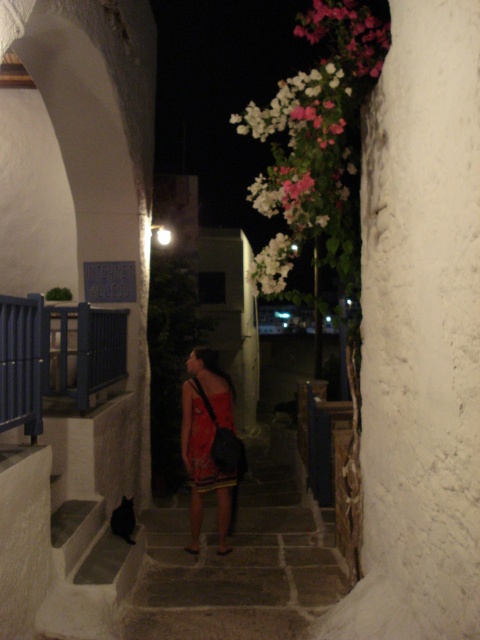
Is white rough textured pillar at center right positioned before red satin dress at center?

Yes, it is in front of red satin dress at center.

Can you confirm if white rough textured pillar at center right is positioned to the right of red satin dress at center?

Yes, white rough textured pillar at center right is to the right of red satin dress at center.

I want to click on white rough textured pillar at center right, so click(x=421, y=324).

Who is lower down, dark gray stone stairs at center or blue painted wood balustrade at left?

dark gray stone stairs at center is below.

Between point (279, 577) and point (32, 374), which one is positioned in front?

Point (32, 374) is more forward.

The image size is (480, 640). What do you see at coordinates (239, 566) in the screenshot?
I see `dark gray stone stairs at center` at bounding box center [239, 566].

Locate an element on the screen. dark gray stone stairs at center is located at coordinates (239, 566).

Between blue painted wood balustrade at left and matte red dress at center, which one appears on the left side from the viewer's perspective?

Positioned to the left is blue painted wood balustrade at left.

Who is more distant from viewer, (122, 340) or (192, 380)?

Point (122, 340)

Where is `blue painted wood balustrade at left`? This screenshot has height=640, width=480. blue painted wood balustrade at left is located at coordinates (55, 356).